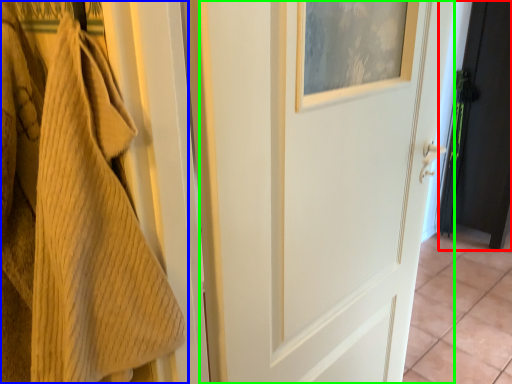
Question: Considering the real-world distances, which object is closest to door (highlighted by a red box)? towel (highlighted by a blue box) or door (highlighted by a green box).

Choices:
 (A) towel
 (B) door

Answer: (B)